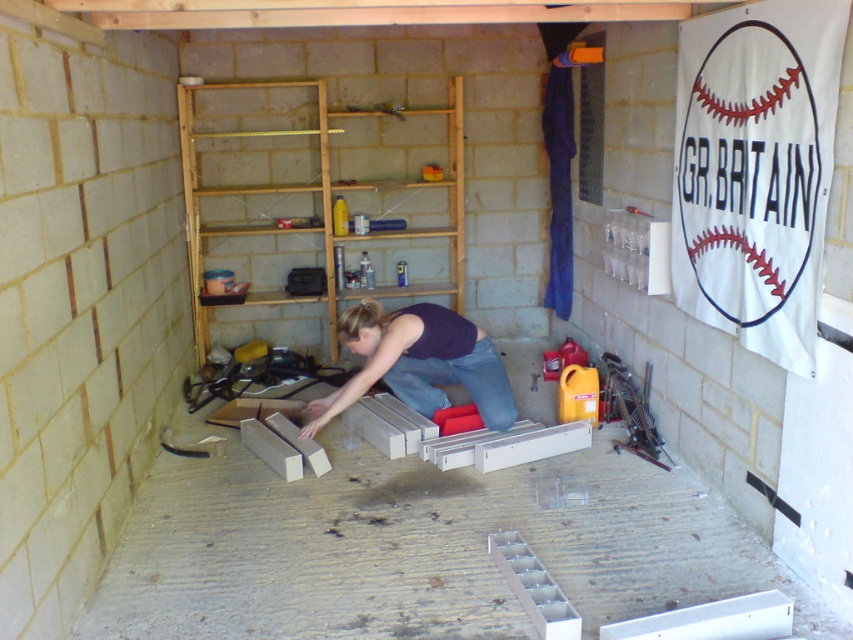
You are a delivery person who needs to place a package between the white matte wood at center and the matte black woman at center. The package is 24 inches long. Will it fit in the space between them?

The distance between the white matte wood at center and the matte black woman at center is 24.43 inches. Since the package is 24 inches long, it will fit with a small amount of space remaining.